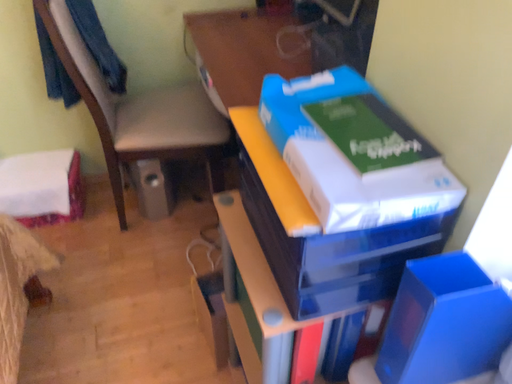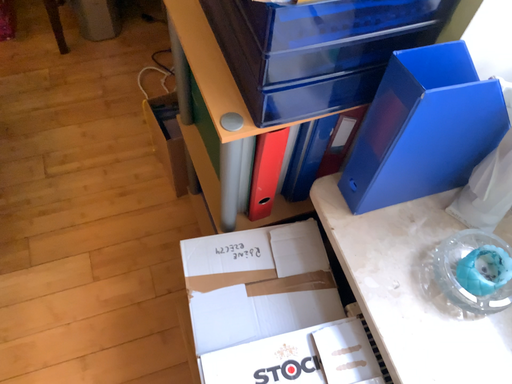
Question: Which way did the camera rotate in the video?

Choices:
 (A) rotated upward
 (B) rotated downward

Answer: (B)